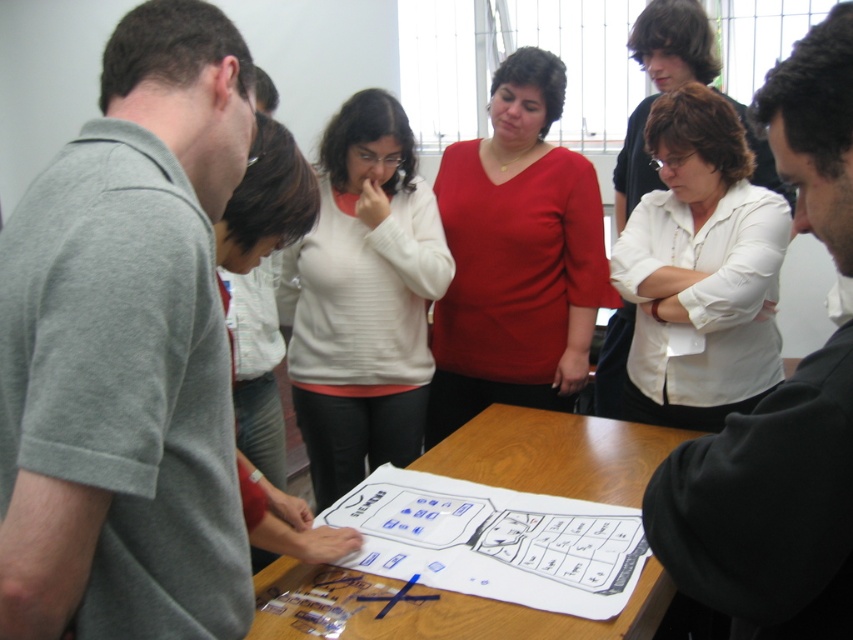
Can you confirm if white ribbed sweater at center is wider than wooden table at center?

Incorrect, white ribbed sweater at center's width does not surpass wooden table at center's.

Who is positioned more to the left, white ribbed sweater at center or wooden table at center?

white ribbed sweater at center is more to the left.

Between point (404, 401) and point (587, 451), which one is positioned behind?

Point (404, 401)

Locate an element on the screen. The image size is (853, 640). white ribbed sweater at center is located at coordinates click(x=363, y=298).

Between gray cotton shirt at left and black matte shirt at center, which one appears on the left side from the viewer's perspective?

gray cotton shirt at left

Is gray cotton shirt at left above black matte shirt at center?

Yes.

Image resolution: width=853 pixels, height=640 pixels. I want to click on gray cotton shirt at left, so click(x=126, y=352).

This screenshot has height=640, width=853. What are the coordinates of `gray cotton shirt at left` in the screenshot? It's located at (126, 352).

Does gray cotton shirt at left have a greater width compared to red matte shirt at center?

No.

Find the location of `gray cotton shirt at left`. gray cotton shirt at left is located at coordinates (126, 352).